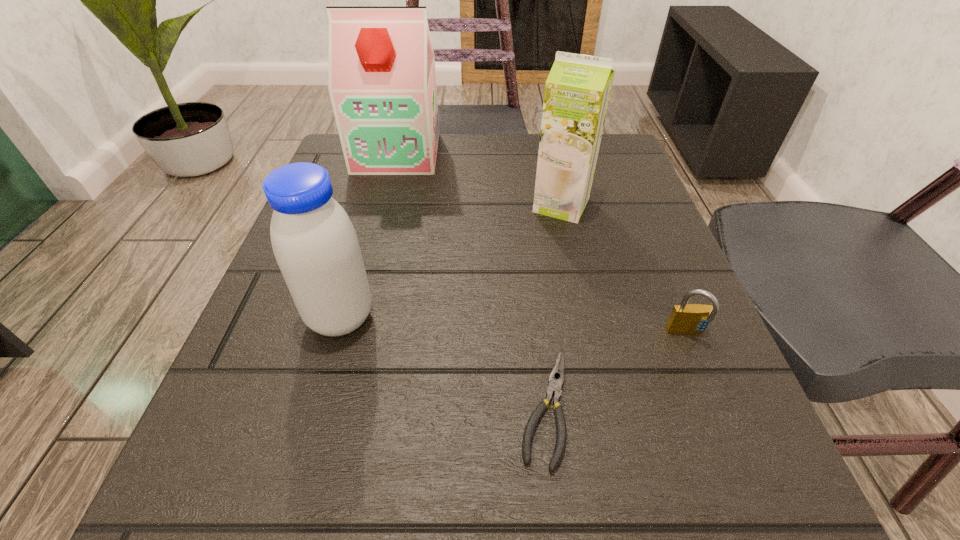
The height and width of the screenshot is (540, 960). Find the location of `the farthest soya milk`. the farthest soya milk is located at coordinates (382, 83).

This screenshot has height=540, width=960. Find the location of `the rightmost soya milk`. the rightmost soya milk is located at coordinates (577, 90).

Identify the location of the second nearest soya milk. (577, 90).

This screenshot has height=540, width=960. In order to click on the nearest soya milk in this screenshot , I will do pyautogui.click(x=314, y=242).

You are a GUI agent. You are given a task and a screenshot of the screen. Output one action in this format:
    pyautogui.click(x=<x>, y=<y>)
    Task: Click on the fourth tallest object
    
    Given the screenshot: What is the action you would take?
    pyautogui.click(x=685, y=318)

Locate an element on the screen. Image resolution: width=960 pixels, height=540 pixels. the rightmost object is located at coordinates (685, 318).

This screenshot has width=960, height=540. I want to click on pliers, so click(x=554, y=387).

Identify the location of the shortest object. (554, 387).

Find the location of `vacant space located with the cap open on the farthest soya milk`. vacant space located with the cap open on the farthest soya milk is located at coordinates (385, 197).

The width and height of the screenshot is (960, 540). In order to click on vacant space located 0.080m on the left of the second farthest object in this screenshot , I will do `click(490, 205)`.